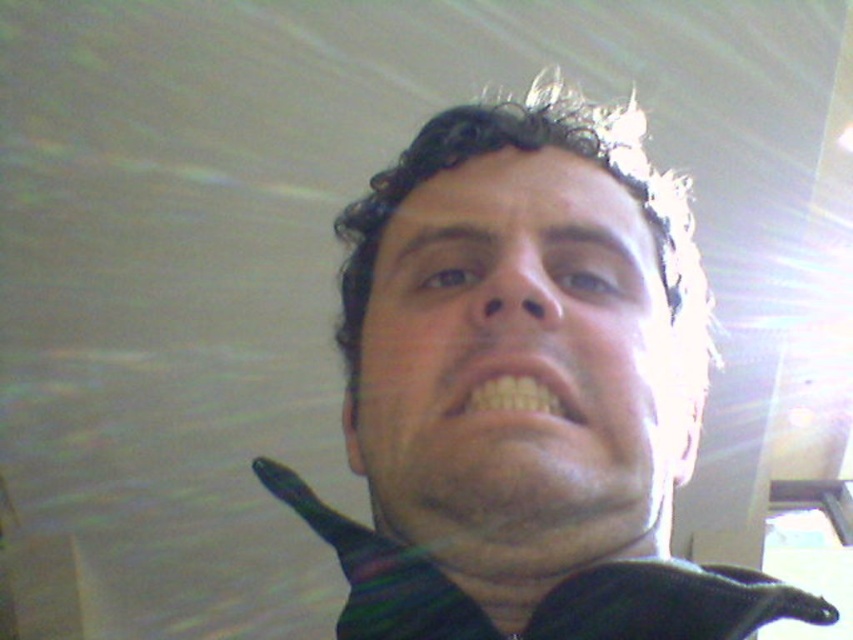
Question: Which object is farther from the camera taking this photo?

Choices:
 (A) black matte face at center
 (B) yellow matte teeth at center
 (C) striped fabric dress shirt at center
 (D) matte black face at center

Answer: (B)

Question: Can you confirm if matte black face at center is positioned below striped fabric dress shirt at center?

Choices:
 (A) no
 (B) yes

Answer: (A)

Question: Is black matte face at center to the left of striped fabric dress shirt at center from the viewer's perspective?

Choices:
 (A) yes
 (B) no

Answer: (B)

Question: Which of these objects is positioned farthest from the yellow matte teeth at center?

Choices:
 (A) matte black face at center
 (B) black matte face at center

Answer: (B)

Question: Which point is closer to the camera taking this photo?

Choices:
 (A) (625, 164)
 (B) (485, 387)
 (C) (525, 244)

Answer: (B)

Question: Considering the relative positions of black matte face at center and striped fabric dress shirt at center in the image provided, where is black matte face at center located with respect to striped fabric dress shirt at center?

Choices:
 (A) below
 (B) above

Answer: (B)